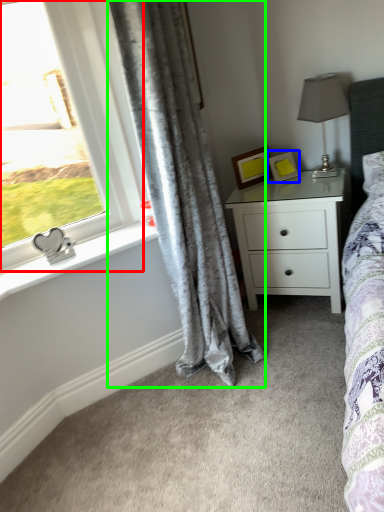
Question: Which is farther away from window (highlighted by a red box)? picture frame (highlighted by a blue box) or curtain (highlighted by a green box)?

Choices:
 (A) picture frame
 (B) curtain

Answer: (A)